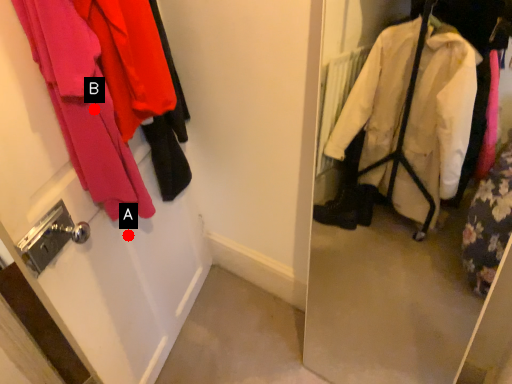
Question: Two points are circled on the image, labeled by A and B beside each circle. Among these points, which one is farthest from the camera?

Choices:
 (A) A is further
 (B) B is further

Answer: (A)